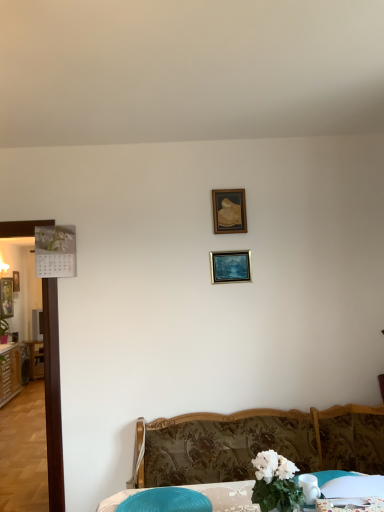
Question: In terms of size, does metallic silver picture frame at left, which is the third picture frame in front-to-back order, appear bigger or smaller than metallic calendar at left, placed as the second picture frame when sorted from bottom to top?

Choices:
 (A) small
 (B) big

Answer: (B)

Question: From the image's perspective, is metallic silver picture frame at left, which is the third picture frame in front-to-back order, above or below metallic calendar at left, placed as the second picture frame when sorted from bottom to top?

Choices:
 (A) below
 (B) above

Answer: (A)

Question: Based on their relative distances, which object is farther from the metallic calendar at left, which is counted as the third picture frame, starting from the top?

Choices:
 (A) blue plastic swivel chair at lower center
 (B) white lace tablecloth at lower right
 (C) patterned fabric bed at lower center
 (D) wooden picture frame at upper center, which appears as the 2th picture frame when viewed from the front
 (E) metallic silver picture frame at left, the third picture frame from the right

Answer: (B)

Question: Estimate the real-world distances between objects in this image. Which object is closer to the patterned fabric bed at lower center?

Choices:
 (A) blue plastic swivel chair at lower center
 (B) metallic calendar at left, which is the 1th picture frame in back-to-front order
 (C) wooden picture frame at upper center, which appears as the fourth picture frame when ordered from the bottom
 (D) metallic silver picture frame at center, acting as the third picture frame starting from the bottom
 (E) green leafy plant at left

Answer: (A)